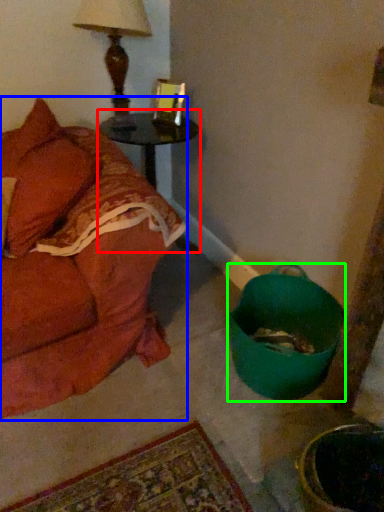
Question: Estimate the real-world distances between objects in this image. Which object is closer to table (highlighted by a red box), studio couch (highlighted by a blue box) or mixing bowl (highlighted by a green box)?

Choices:
 (A) studio couch
 (B) mixing bowl

Answer: (A)